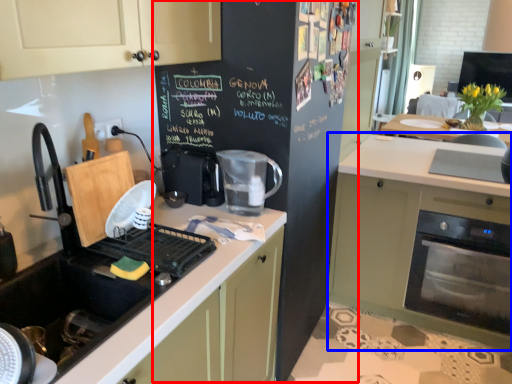
Question: Which of the following is the farthest to the observer, bulletin board (highlighted by a red box) or cabinetry (highlighted by a blue box)?

Choices:
 (A) bulletin board
 (B) cabinetry

Answer: (B)